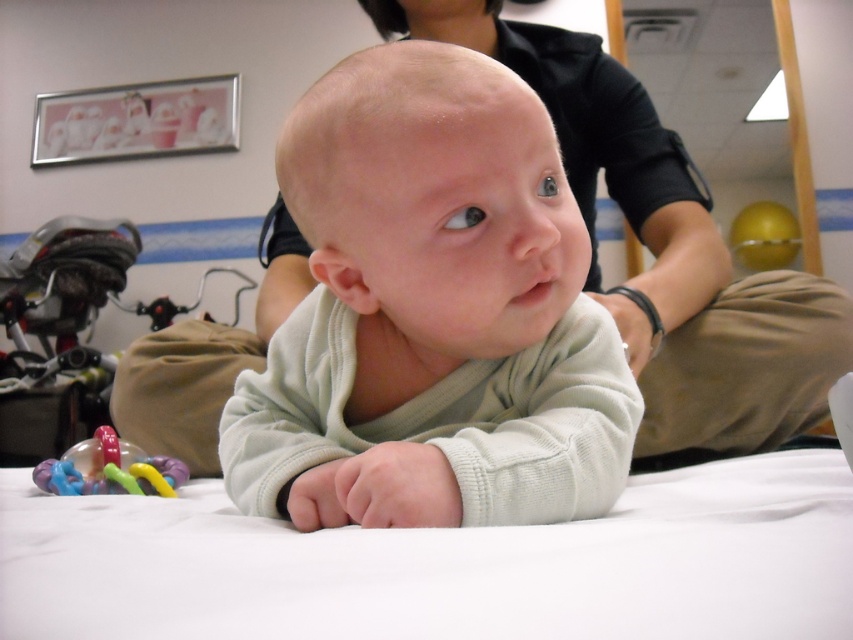
Question: Can you confirm if light green fleece baby at center is smaller than white soft baby at center?

Choices:
 (A) no
 (B) yes

Answer: (B)

Question: Which object is positioned farthest from the rubberized plastic teething ring at lower left?

Choices:
 (A) white soft baby at center
 (B) light green fleece baby at center

Answer: (A)

Question: Among these objects, which one is nearest to the camera?

Choices:
 (A) rubberized plastic teething ring at lower left
 (B) white soft baby at center

Answer: (A)

Question: Which of the following is the closest to the observer?

Choices:
 (A) rubberized plastic teething ring at lower left
 (B) light green fleece baby at center

Answer: (B)

Question: Is light green fleece baby at center positioned behind white soft baby at center?

Choices:
 (A) yes
 (B) no

Answer: (B)

Question: Does white soft baby at center appear over rubberized plastic teething ring at lower left?

Choices:
 (A) yes
 (B) no

Answer: (A)